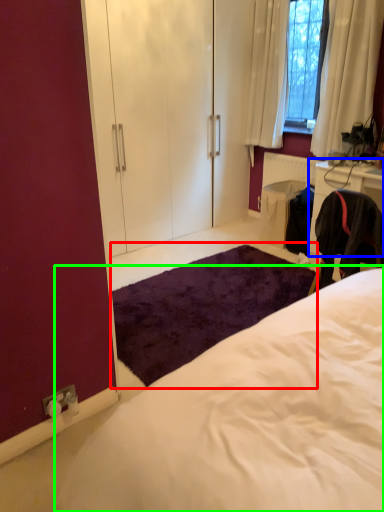
Question: Based on their relative distances, which object is farther from mat (highlighted by a red box)? Choose from cabinetry (highlighted by a blue box) and bed (highlighted by a green box).

Choices:
 (A) cabinetry
 (B) bed

Answer: (B)